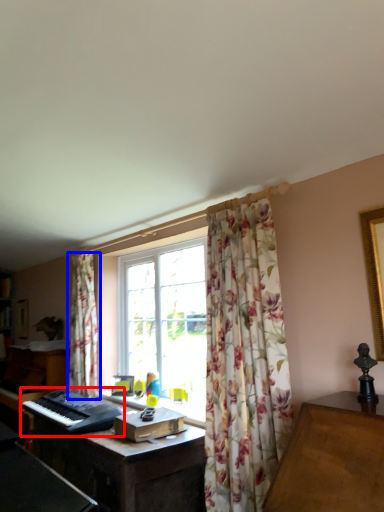
Question: Which of the following is the closest to the observer, musical keyboard (highlighted by a red box) or curtain (highlighted by a blue box)?

Choices:
 (A) musical keyboard
 (B) curtain

Answer: (A)